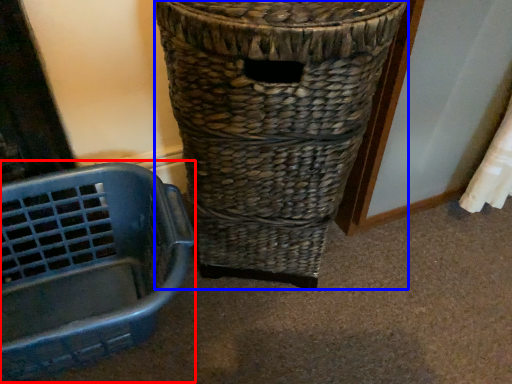
Question: Which object is closer to the camera taking this photo, basket container (highlighted by a red box) or waste container (highlighted by a blue box)?

Choices:
 (A) basket container
 (B) waste container

Answer: (B)